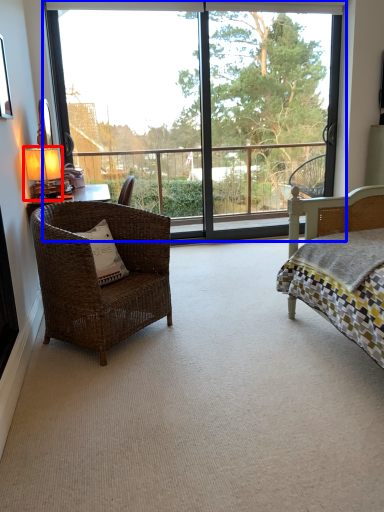
Question: Which point is further to the camera, table lamp (highlighted by a red box) or window (highlighted by a blue box)?

Choices:
 (A) table lamp
 (B) window

Answer: (B)